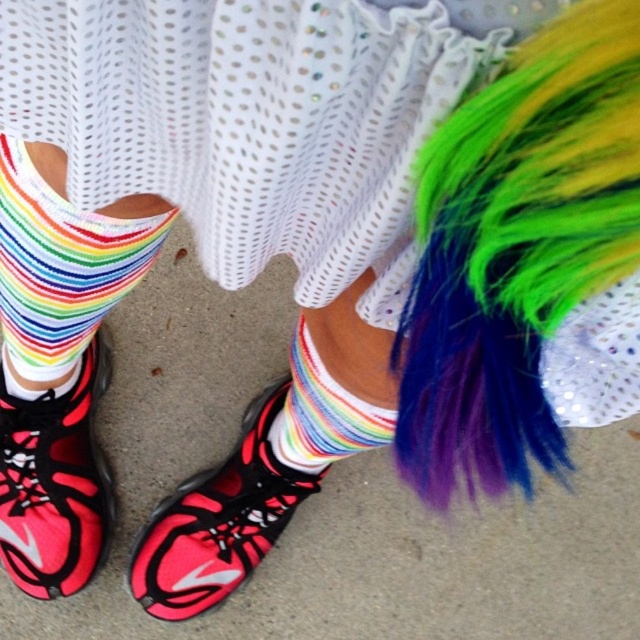
In the scene shown: You are a fashion stylist preparing for a photoshoot. You have a rainbow feather boa at lower right and a shiny pink and black sneaker at lower left in the scene. Which accessory is narrower in width?

The rainbow feather boa at lower right is thinner than the shiny pink and black sneaker at lower left, so the rainbow feather boa at lower right is narrower in width.

You are organizing a costume party and need to decide which item takes up more space in your bag. Based on the image, which item is larger between the rainbow feather boa at lower right and the rainbow striped sock at center?

The rainbow feather boa at lower right occupies less space than the rainbow striped sock at center, so the rainbow striped sock at center is larger and will take up more space in the bag.

You are standing in front of the image and want to point to the rainbow striped socks at lower left. What is the exact 2D coordinate where you should point?

The exact 2D coordinate where you should point to the rainbow striped socks at lower left is at point (x=60, y=268).